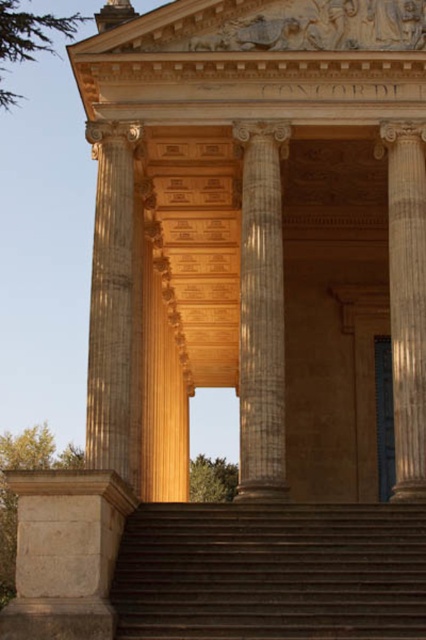
Question: From the image, what is the correct spatial relationship of brown stone stairs at center in relation to smooth stone column at right?

Choices:
 (A) above
 (B) below

Answer: (B)

Question: Is smooth beige column at center to the right of smooth stone column at right from the viewer's perspective?

Choices:
 (A) yes
 (B) no

Answer: (B)

Question: Which point appears closest to the camera in this image?

Choices:
 (A) pyautogui.click(x=391, y=166)
 (B) pyautogui.click(x=261, y=276)
 (C) pyautogui.click(x=328, y=608)
 (D) pyautogui.click(x=115, y=180)

Answer: (C)

Question: Which point is closer to the camera?

Choices:
 (A) (115, 300)
 (B) (265, 476)
 (C) (267, 536)

Answer: (C)

Question: Is brown stone stairs at center above white marble column at center?

Choices:
 (A) no
 (B) yes

Answer: (A)

Question: Which of the following is the closest to the observer?

Choices:
 (A) (394, 500)
 (B) (296, 545)
 (C) (249, 304)
 (D) (120, 148)

Answer: (B)